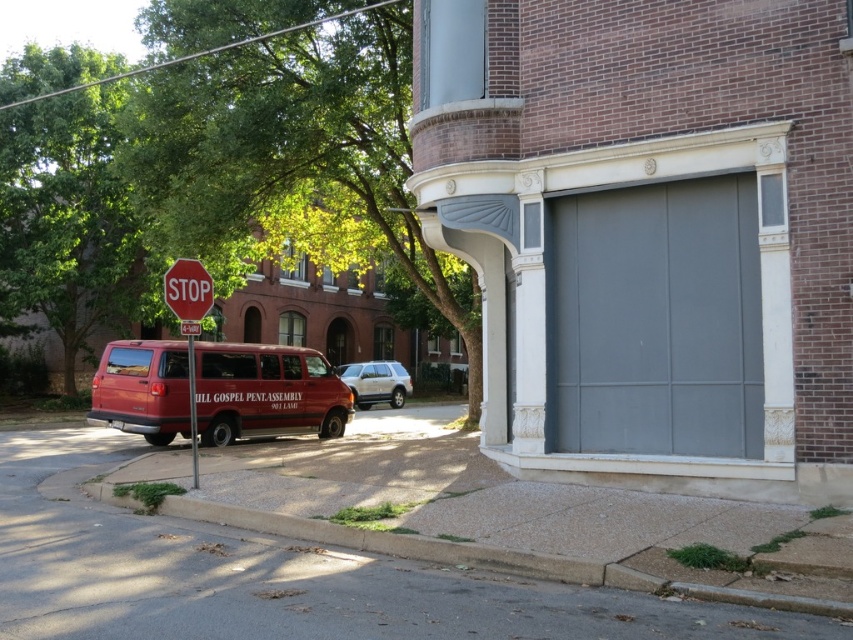
Can you confirm if matte red van at lower left is positioned to the left of red matte stop sign at left?

Yes, matte red van at lower left is to the left of red matte stop sign at left.

Between matte red van at lower left and red matte stop sign at left, which one has more height?

matte red van at lower left

Which is behind, point (303, 428) or point (206, 296)?

Point (303, 428)

Locate an element on the screen. This screenshot has height=640, width=853. matte red van at lower left is located at coordinates (265, 392).

Who is lower down, gray concrete pavement at lower left or red matte stop sign at left?

gray concrete pavement at lower left

Which of these two, gray concrete pavement at lower left or red matte stop sign at left, stands shorter?

gray concrete pavement at lower left is shorter.

The width and height of the screenshot is (853, 640). I want to click on gray concrete pavement at lower left, so click(x=279, y=577).

Is gray matte/glossy garage door at center positioned behind matte red van at lower left?

No, gray matte/glossy garage door at center is in front of matte red van at lower left.

Who is more forward, (726, 451) or (103, 360)?

Point (726, 451)

Which is in front, point (672, 336) or point (273, 424)?

Point (672, 336) is in front.

Identify the location of gray matte/glossy garage door at center. This screenshot has width=853, height=640. (654, 320).